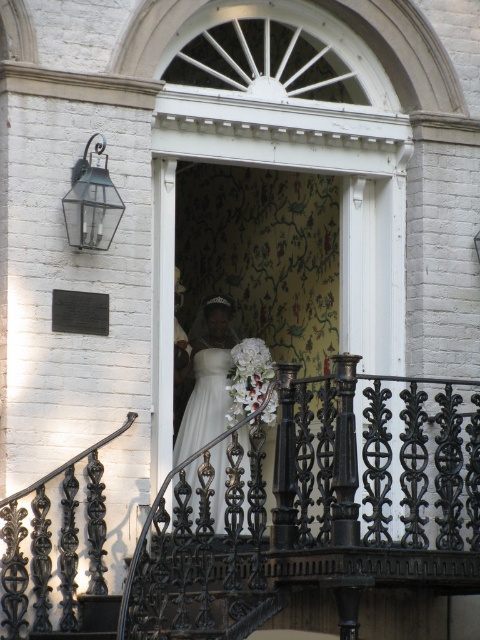
In the scene shown: Can you confirm if black wrought iron railing at center is thinner than white satin dress at center?

No.

Does black wrought iron railing at center appear on the right side of white satin dress at center?

Yes, black wrought iron railing at center is to the right of white satin dress at center.

I want to click on black wrought iron railing at center, so click(x=314, y=506).

Is point (146, 560) closer to camera compared to point (237, 392)?

Yes, it is in front of point (237, 392).

Is the position of black wrought iron railing at center more distant than that of white silk bouquet at center?

No, black wrought iron railing at center is closer to the viewer.

This screenshot has height=640, width=480. What do you see at coordinates (314, 506) in the screenshot? I see `black wrought iron railing at center` at bounding box center [314, 506].

This screenshot has width=480, height=640. Find the location of `black wrought iron railing at center`. black wrought iron railing at center is located at coordinates (314, 506).

Between white satin dress at center and white silk bouquet at center, which one appears on the left side from the viewer's perspective?

white satin dress at center is more to the left.

Who is higher up, white satin dress at center or white silk bouquet at center?

white silk bouquet at center is higher up.

Does point (224, 305) lie in front of point (237, 352)?

No, it is not.

You are a GUI agent. You are given a task and a screenshot of the screen. Output one action in this format:
    pyautogui.click(x=<x>, y=<y>)
    Task: Click on the white satin dress at center
    Image resolution: width=480 pixels, height=640 pixels.
    Given the screenshot: What is the action you would take?
    pyautogui.click(x=207, y=380)